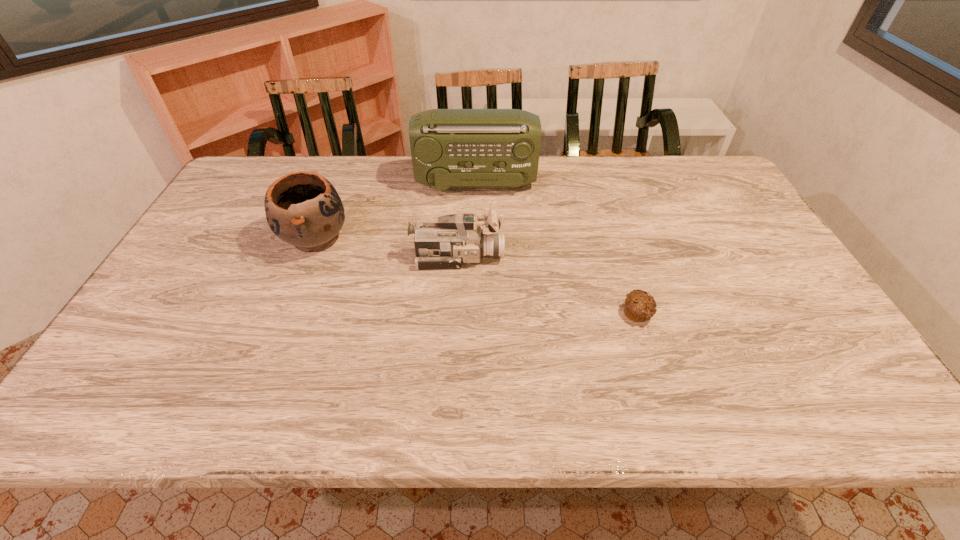
Find the location of a particular element. The width and height of the screenshot is (960, 540). blank region between the shortest object and the pottery is located at coordinates (476, 276).

Image resolution: width=960 pixels, height=540 pixels. What are the coordinates of `vacant area that lies between the camcorder and the shortest object` in the screenshot? It's located at (548, 285).

Find the location of a particular element. Image resolution: width=960 pixels, height=540 pixels. the third closest object relative to the muffin is located at coordinates (303, 209).

Locate an element on the screen. object that is the closest to the radio_receiver is located at coordinates (303, 209).

Find the location of a particular element. Image resolution: width=960 pixels, height=540 pixels. vacant area that satisfies the following two spatial constraints: 1. on the front-facing side of the shortest object; 2. on the left side of the camcorder is located at coordinates (455, 314).

You are a GUI agent. You are given a task and a screenshot of the screen. Output one action in this format:
    pyautogui.click(x=<x>, y=<y>)
    Task: Click on the free space that satisfies the following two spatial constraints: 1. on the front-facing side of the nearest object; 2. on the right side of the farthest object
    The image size is (960, 540).
    Given the screenshot: What is the action you would take?
    pyautogui.click(x=473, y=314)

You are a GUI agent. You are given a task and a screenshot of the screen. Output one action in this format:
    pyautogui.click(x=<x>, y=<y>)
    Task: Click on the vacant space that satisfies the following two spatial constraints: 1. on the front-facing side of the farthest object; 2. on the right side of the nearest object
    
    Given the screenshot: What is the action you would take?
    pyautogui.click(x=473, y=314)